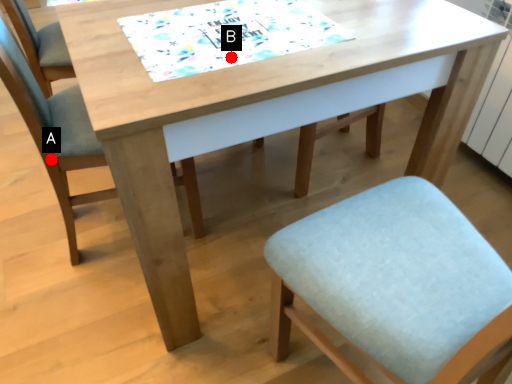
Question: Two points are circled on the image, labeled by A and B beside each circle. Among these points, which one is nearest to the camera?

Choices:
 (A) A is closer
 (B) B is closer

Answer: (B)